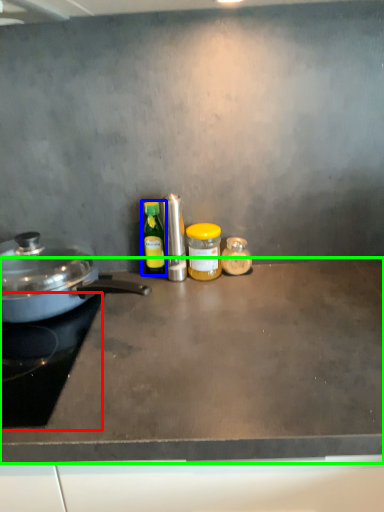
Question: Considering the real-world distances, which object is farthest from gas stove (highlighted by a red box)? kitchen appliance (highlighted by a blue box) or countertop (highlighted by a green box)?

Choices:
 (A) kitchen appliance
 (B) countertop

Answer: (A)